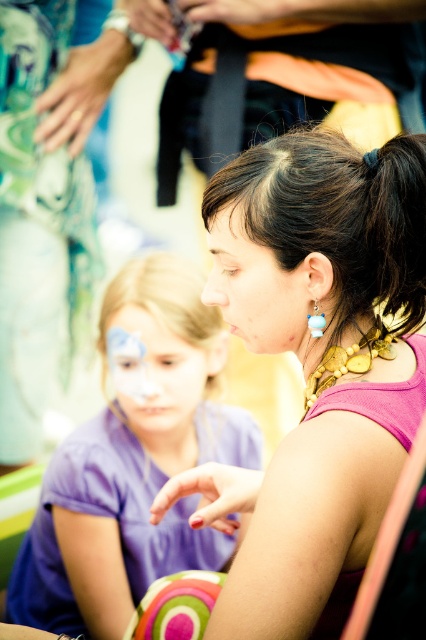
You are an artist observing the scene. You notice two purple elements in the image. The first is the purple fabric shirt at center, and the second is the matte purple face at center. Which of these two purple elements is located to the right of the other?

The purple fabric shirt at center is positioned on the right side of matte purple face at center.

You are an artist trying to sketch the scene. The matte pink face at center is crucial for your drawing. Where exactly should you place it on your canvas?

You should place the matte pink face at center at the coordinates point (x=256, y=289) on your canvas.

You are standing at the entrance of the room and see the purple fabric shirt at center. What are its coordinates in the image?

The purple fabric shirt at center is located at coordinates point (132, 460).